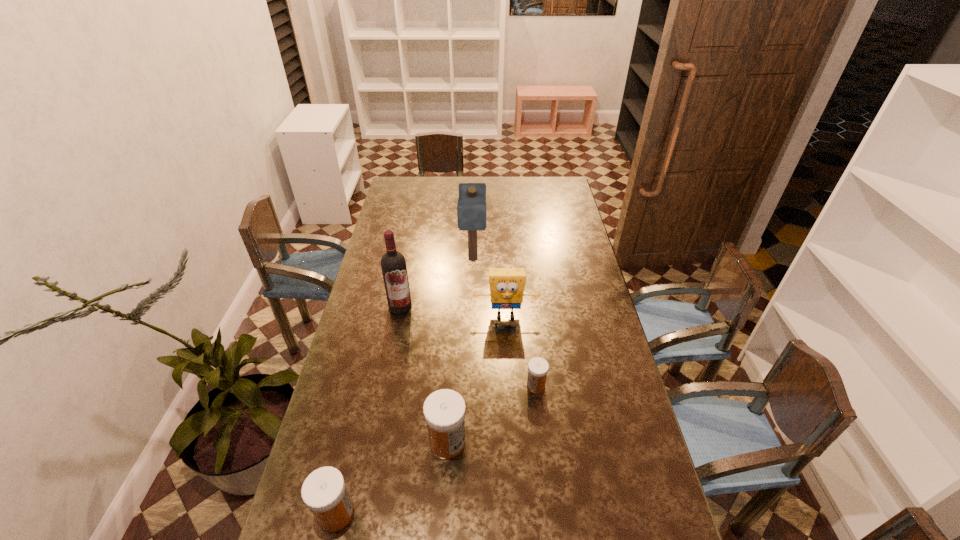
Find the location of a particular element. The width and height of the screenshot is (960, 540). the leftmost medicine is located at coordinates (324, 492).

Find the location of a particular element. the second shortest medicine is located at coordinates (324, 492).

Identify the location of the fifth farthest object. The width and height of the screenshot is (960, 540). (444, 410).

This screenshot has width=960, height=540. I want to click on the second medicine from left to right, so [444, 410].

You are a GUI agent. You are given a task and a screenshot of the screen. Output one action in this format:
    pyautogui.click(x=<x>, y=<y>)
    Task: Click on the rightmost medicine
    
    Given the screenshot: What is the action you would take?
    pyautogui.click(x=538, y=367)

Identify the location of the third nearest object. This screenshot has height=540, width=960. (538, 367).

Image resolution: width=960 pixels, height=540 pixels. Identify the location of wine bottle. (393, 264).

Locate an element on the screen. mallet is located at coordinates (471, 209).

Image resolution: width=960 pixels, height=540 pixels. Identify the location of sponge. (507, 286).

Locate an element on the screen. The width and height of the screenshot is (960, 540). vacant region located 0.110m on the back of the leftmost medicine is located at coordinates (349, 454).